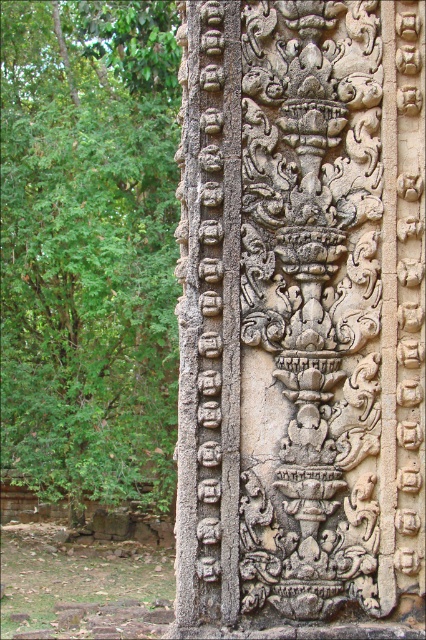
Question: Is carved stone vase at center smaller than green leafy tree at left?

Choices:
 (A) yes
 (B) no

Answer: (A)

Question: Among these objects, which one is farthest from the camera?

Choices:
 (A) carved stone vase at center
 (B) green leafy tree at left

Answer: (B)

Question: Is carved stone vase at center wider than green leafy tree at left?

Choices:
 (A) yes
 (B) no

Answer: (B)

Question: Which point is farther to the camera?

Choices:
 (A) green leafy tree at left
 (B) carved stone vase at center

Answer: (A)

Question: Is carved stone vase at center smaller than green leafy tree at left?

Choices:
 (A) no
 (B) yes

Answer: (B)